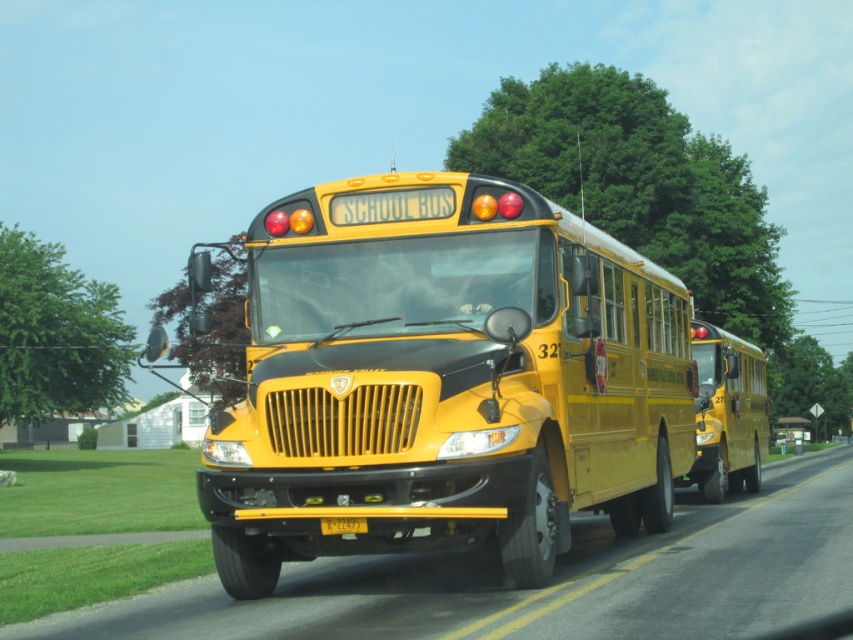
You are a pedestrian standing on the sidewalk. You see the yellow matte school bus at center and the yellow matte license plate at center in the image. Which object is nearer to you?

The yellow matte school bus at center is closer to the viewer than the yellow matte license plate at center.